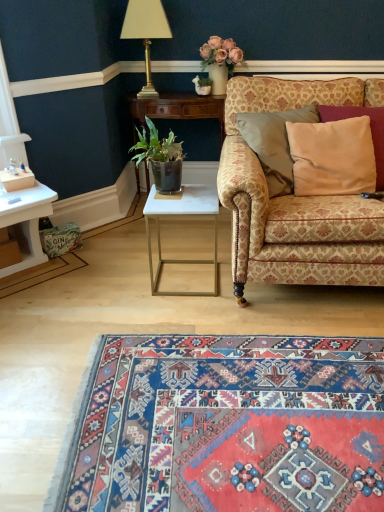
Identify the location of vacant area that lies between white marble table at center, which is the second table in top-to-bottom order, and patterned fabric couch at right. (191, 258).